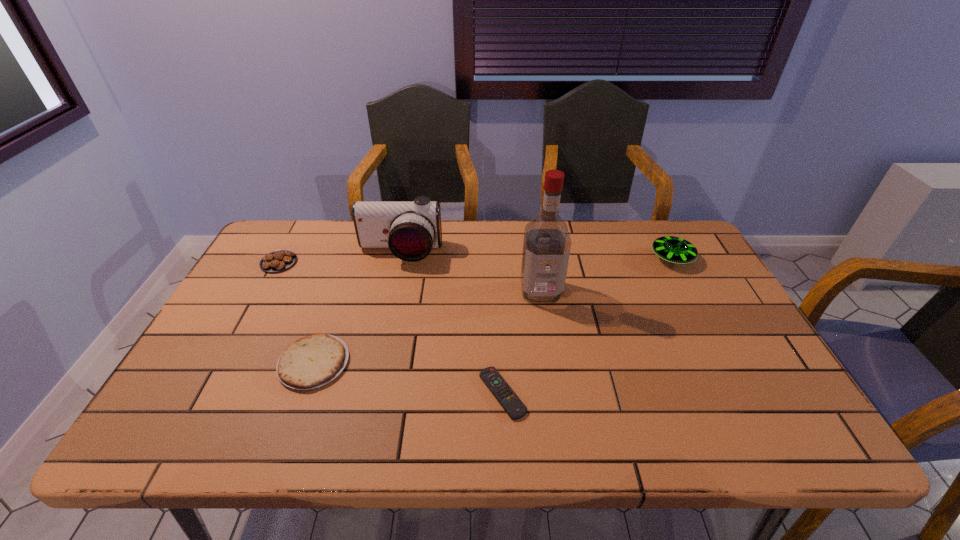
The image size is (960, 540). In order to click on blank space located 0.120m on the surface of the camcorder in this screenshot , I will do `click(391, 293)`.

This screenshot has height=540, width=960. I want to click on vacant space located on the left of the fourth shortest object, so click(x=631, y=259).

In order to click on free space located 0.350m on the right of the pastry in this screenshot , I will do tap(409, 262).

At what (x,y) coordinates should I click in order to perform the action: click on vacant space located on the right of the tortilla. Please return your answer as a coordinate pair (x, y). The image size is (960, 540). Looking at the image, I should click on (381, 363).

This screenshot has height=540, width=960. What are the coordinates of `vacant space situated 0.330m on the left of the remote control` in the screenshot? It's located at (336, 393).

Where is `camcorder present at the far edge`? The width and height of the screenshot is (960, 540). camcorder present at the far edge is located at coordinates (410, 229).

The width and height of the screenshot is (960, 540). I want to click on saucer at the far edge, so click(x=672, y=249).

You are a GUI agent. You are given a task and a screenshot of the screen. Output one action in this format:
    pyautogui.click(x=<x>, y=<y>)
    Task: Click on the pastry present at the far edge
    The width and height of the screenshot is (960, 540).
    Given the screenshot: What is the action you would take?
    pyautogui.click(x=279, y=260)

At what (x,y) coordinates should I click in order to perform the action: click on object situated at the near edge. Please return your answer as a coordinate pair (x, y). Looking at the image, I should click on (511, 403).

Image resolution: width=960 pixels, height=540 pixels. I want to click on object located at the left edge, so click(x=279, y=260).